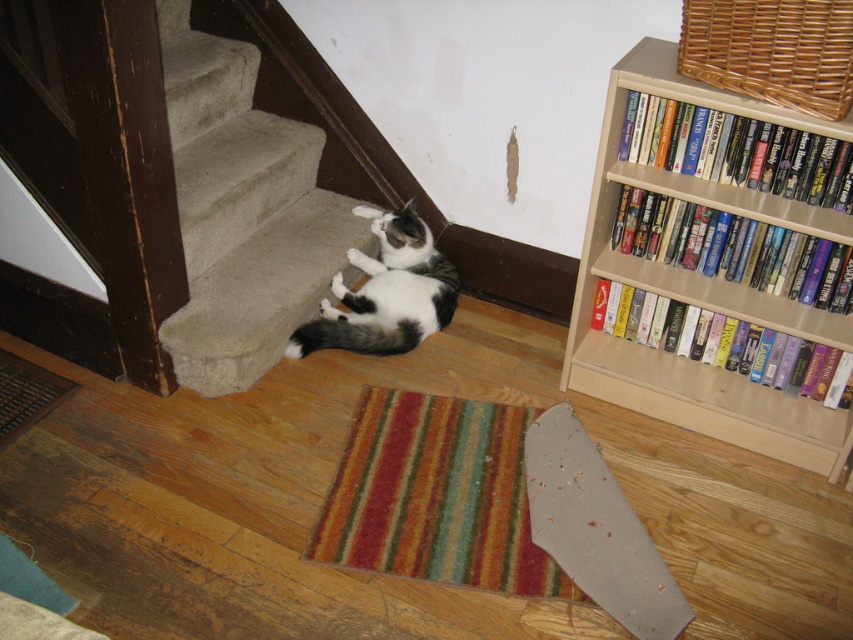
You are standing at the entrance of the room and want to reach the black and white fur cat at lower center. Which object, the beige wood bookcase at upper right or the cat, is closer to you as you approach?

The beige wood bookcase at upper right is closer to you than the black and white fur cat at lower center because it is in front of the cat.